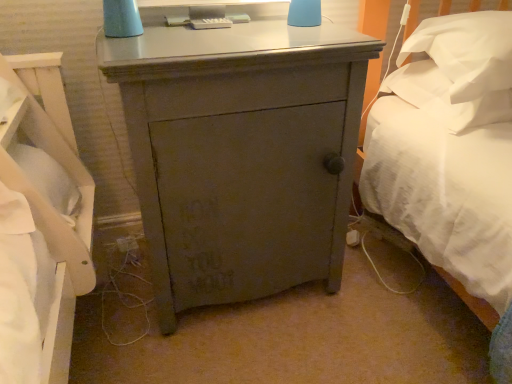
Question: Can you confirm if white soft pillow at upper right, the 2th pillow ordered from the bottom, is positioned to the right of white soft pillow at right, marked as the 1th pillow in a bottom-to-top arrangement?

Choices:
 (A) yes
 (B) no

Answer: (A)

Question: From the image's perspective, does white soft pillow at upper right, the 2th pillow ordered from the bottom, appear lower than white soft pillow at right, the second pillow positioned from the top?

Choices:
 (A) yes
 (B) no

Answer: (B)

Question: Can you confirm if white soft pillow at upper right, which is counted as the 1th pillow, starting from the top, is smaller than white soft pillow at right, marked as the 1th pillow in a bottom-to-top arrangement?

Choices:
 (A) no
 (B) yes

Answer: (A)

Question: Is the depth of white soft pillow at upper right, the 2th pillow ordered from the bottom, less than that of white soft pillow at right, marked as the 1th pillow in a bottom-to-top arrangement?

Choices:
 (A) no
 (B) yes

Answer: (B)

Question: From a real-world perspective, is white soft pillow at upper right, which is counted as the 1th pillow, starting from the top, positioned over white soft pillow at right, the second pillow positioned from the top, based on gravity?

Choices:
 (A) no
 (B) yes

Answer: (B)

Question: Considering the positions of white soft pillow at right, the second pillow positioned from the top, and white soft pillow at upper right, which is counted as the 1th pillow, starting from the top, in the image, is white soft pillow at right, the second pillow positioned from the top, wider or thinner than white soft pillow at upper right, which is counted as the 1th pillow, starting from the top,?

Choices:
 (A) wide
 (B) thin

Answer: (A)

Question: Considering the positions of white soft pillow at right, the second pillow positioned from the top, and white soft pillow at upper right, which is counted as the 1th pillow, starting from the top, in the image, is white soft pillow at right, the second pillow positioned from the top, taller or shorter than white soft pillow at upper right, which is counted as the 1th pillow, starting from the top,?

Choices:
 (A) tall
 (B) short

Answer: (B)

Question: Considering the positions of point (420, 64) and point (486, 69), is point (420, 64) closer or farther from the camera than point (486, 69)?

Choices:
 (A) farther
 (B) closer

Answer: (A)

Question: From a real-world perspective, relative to white soft pillow at upper right, the 2th pillow ordered from the bottom, is white soft pillow at right, marked as the 1th pillow in a bottom-to-top arrangement, vertically above or below?

Choices:
 (A) above
 (B) below

Answer: (B)

Question: In terms of height, does white soft pillow at upper right, which is counted as the 1th pillow, starting from the top, look taller or shorter compared to white soft pillow at right, the second pillow positioned from the top?

Choices:
 (A) short
 (B) tall

Answer: (B)

Question: Is point (492, 26) positioned closer to the camera than point (498, 102)?

Choices:
 (A) farther
 (B) closer

Answer: (B)

Question: Relative to white soft pillow at right, the second pillow positioned from the top, is white soft pillow at upper right, the 2th pillow ordered from the bottom, in front or behind?

Choices:
 (A) behind
 (B) front

Answer: (B)

Question: Is white soft pillow at upper right, which is counted as the 1th pillow, starting from the top, inside or outside of white soft pillow at right, marked as the 1th pillow in a bottom-to-top arrangement?

Choices:
 (A) outside
 (B) inside

Answer: (A)

Question: Is white soft pillow at right, the second pillow positioned from the top, wider or thinner than matte gray cabinet at center?

Choices:
 (A) thin
 (B) wide

Answer: (A)

Question: Is point (437, 69) closer or farther from the camera than point (181, 294)?

Choices:
 (A) closer
 (B) farther

Answer: (B)